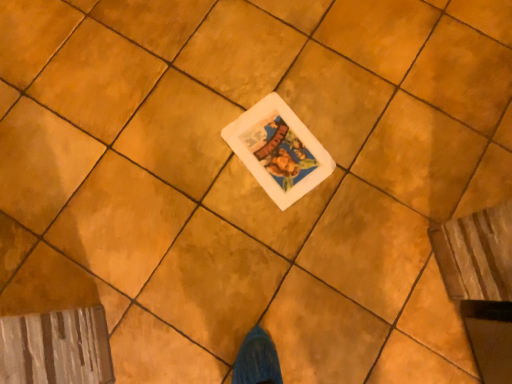
Locate an element on the screen. The height and width of the screenshot is (384, 512). free point to the left of white matte comic book at center is located at coordinates (197, 143).